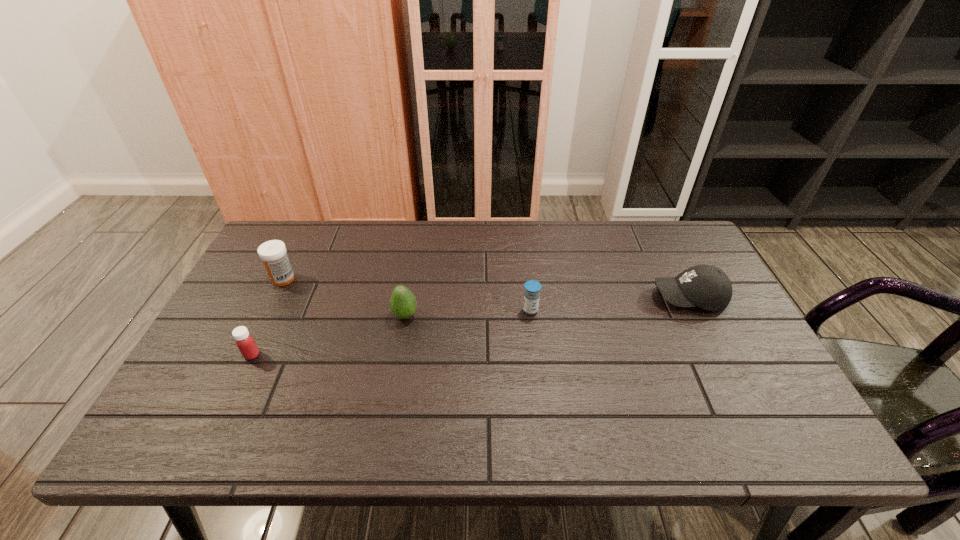
At what (x,y) coordinates should I click in order to perform the action: click on the fourth closest object to the nearest medicine. Please return your answer as a coordinate pair (x, y). The width and height of the screenshot is (960, 540). Looking at the image, I should click on (705, 286).

This screenshot has width=960, height=540. Identify the location of medicine that is the second closest to the farthest medicine. (x=532, y=288).

Find the location of a particular element. The height and width of the screenshot is (540, 960). the second closest medicine relative to the nearest medicine is located at coordinates (532, 288).

Locate an element on the screen. The image size is (960, 540). vacant space that satisfies the following two spatial constraints: 1. on the back side of the third object from right to left; 2. on the left side of the fourth object from left to right is located at coordinates (406, 310).

What are the coordinates of `vacant space that satisfies the following two spatial constraints: 1. on the front side of the farthest medicine; 2. on the right side of the nearest object` in the screenshot? It's located at (246, 355).

Find the location of a particular element. free space in the image that satisfies the following two spatial constraints: 1. on the back side of the nearest object; 2. on the left side of the second farthest medicine is located at coordinates (274, 310).

Locate an element on the screen. Image resolution: width=960 pixels, height=540 pixels. blank area in the image that satisfies the following two spatial constraints: 1. on the front-facing side of the baseball cap; 2. on the front side of the nearest medicine is located at coordinates click(x=717, y=355).